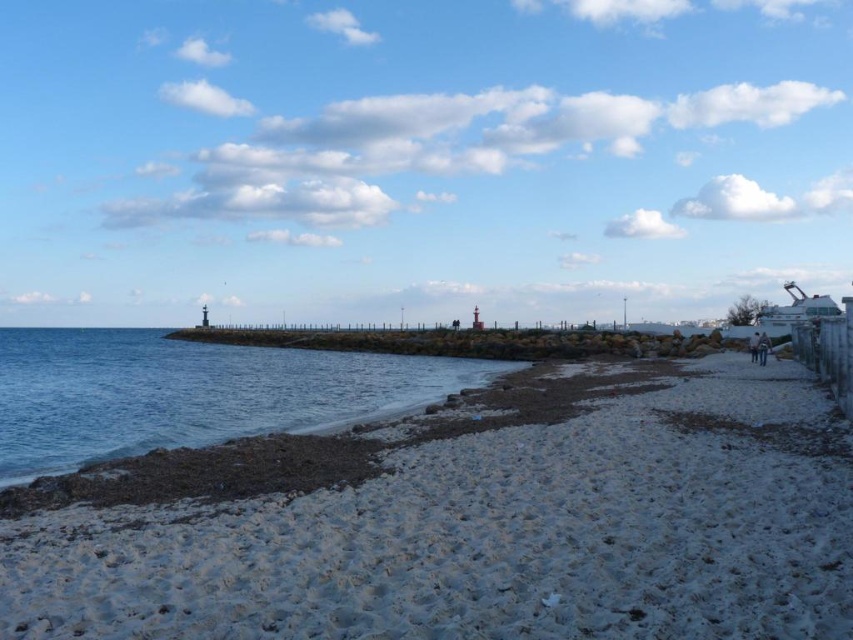
Can you confirm if white sandy beach at lower left is thinner than dark blue jeans at lower right?

No.

Measure the distance from white sandy beach at lower left to dark blue jeans at lower right.

white sandy beach at lower left is 34.10 meters from dark blue jeans at lower right.

Who is more forward, [345,625] or [753,356]?

Point [345,625] is in front.

Find the location of a particular element. This screenshot has height=640, width=853. white sandy beach at lower left is located at coordinates (492, 536).

Is white sandy beach at lower left wider than blue water at lower left?

No, white sandy beach at lower left is not wider than blue water at lower left.

Is point (572, 486) positioned before point (51, 348)?

Yes, it is in front of point (51, 348).

Find the location of a particular element. The height and width of the screenshot is (640, 853). white sandy beach at lower left is located at coordinates (492, 536).

Is point (440, 364) less distant than point (766, 352)?

No.

Which is behind, point (0, 406) or point (764, 339)?

Point (764, 339)

This screenshot has width=853, height=640. In order to click on blue water at lower left in this screenshot , I will do `click(190, 392)`.